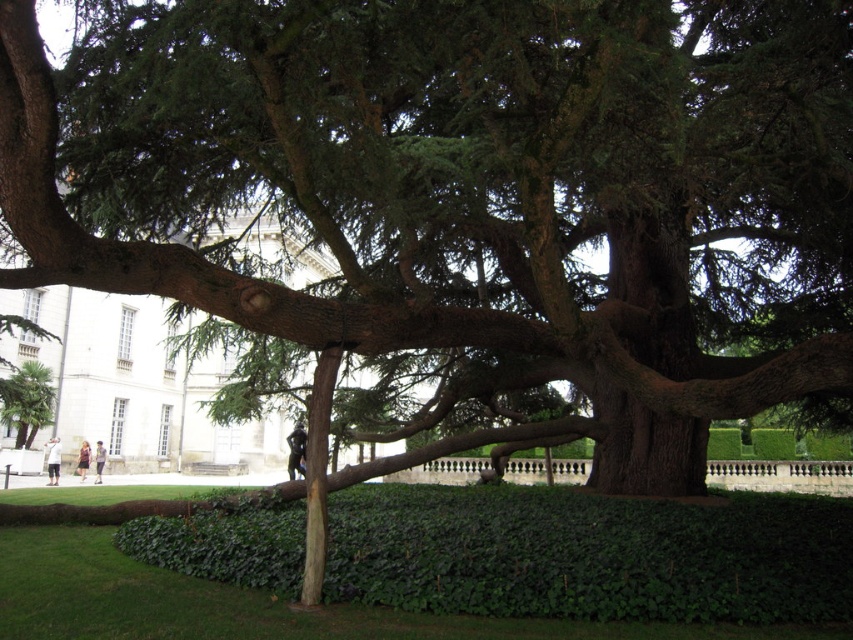
Question: Is green leafy hedge at lower center to the right of green leafy palm at lower left from the viewer's perspective?

Choices:
 (A) yes
 (B) no

Answer: (A)

Question: Is brown rough bark at center above green leafy palm at lower left?

Choices:
 (A) no
 (B) yes

Answer: (B)

Question: Which of these objects is positioned farthest from the brown rough bark at center?

Choices:
 (A) green leafy hedge at lower center
 (B) green leafy palm at lower left

Answer: (B)

Question: Where is brown rough bark at center located in relation to green leafy palm at lower left in the image?

Choices:
 (A) below
 (B) above

Answer: (B)

Question: Which object is closer to the camera taking this photo?

Choices:
 (A) green leafy hedge at lower center
 (B) brown rough bark at center

Answer: (A)

Question: Among these objects, which one is nearest to the camera?

Choices:
 (A) green leafy palm at lower left
 (B) green leafy hedge at lower center

Answer: (B)